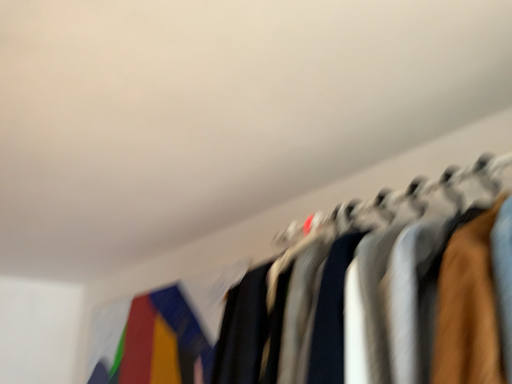
The height and width of the screenshot is (384, 512). What do you see at coordinates (401, 200) in the screenshot?
I see `silky fabric shirts at center` at bounding box center [401, 200].

Where is `silky fabric shirts at center`? silky fabric shirts at center is located at coordinates (401, 200).

At what (x,y) coordinates should I click in order to perform the action: click on silky fabric shirts at center. Please return your answer as a coordinate pair (x, y). Looking at the image, I should click on (401, 200).